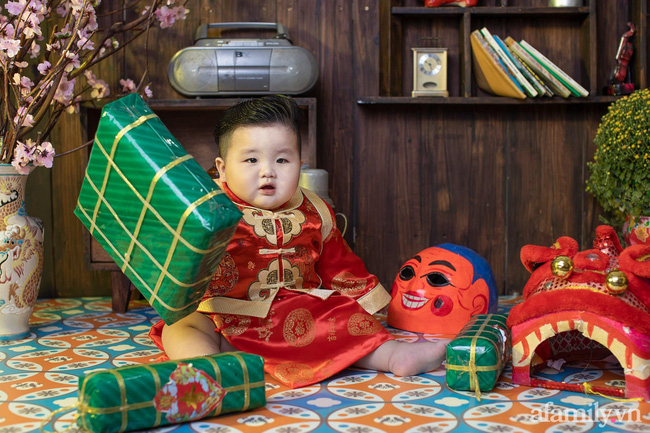
The image size is (650, 433). What are the coordinates of `shelf` in the screenshot? It's located at (520, 8).